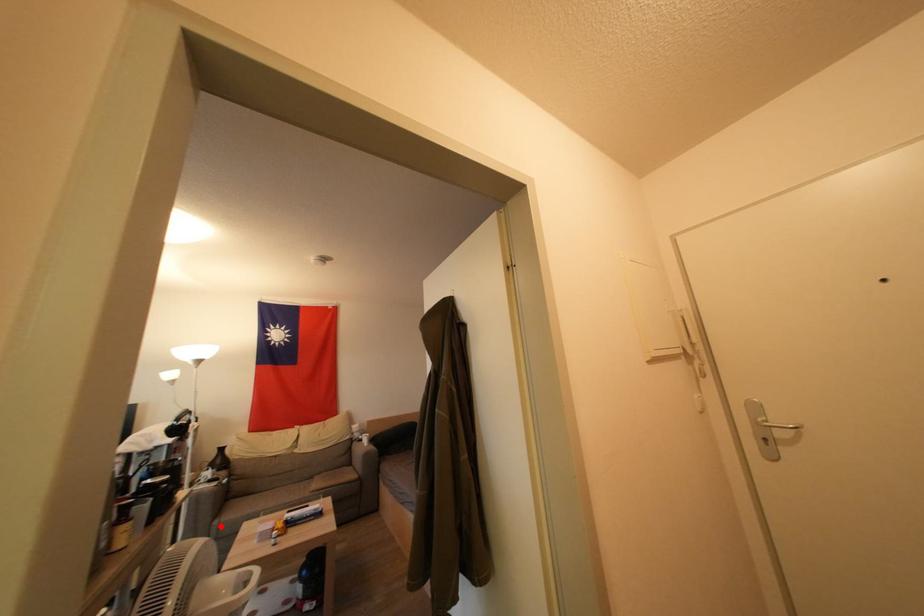
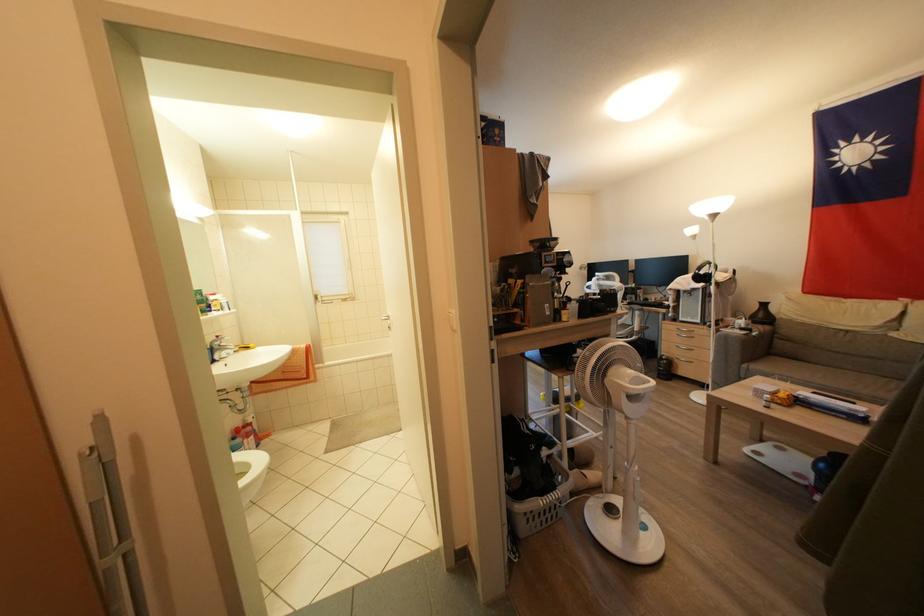
Where in the second image is the point corresponding to the highlighted location from the first image?

(748, 370)